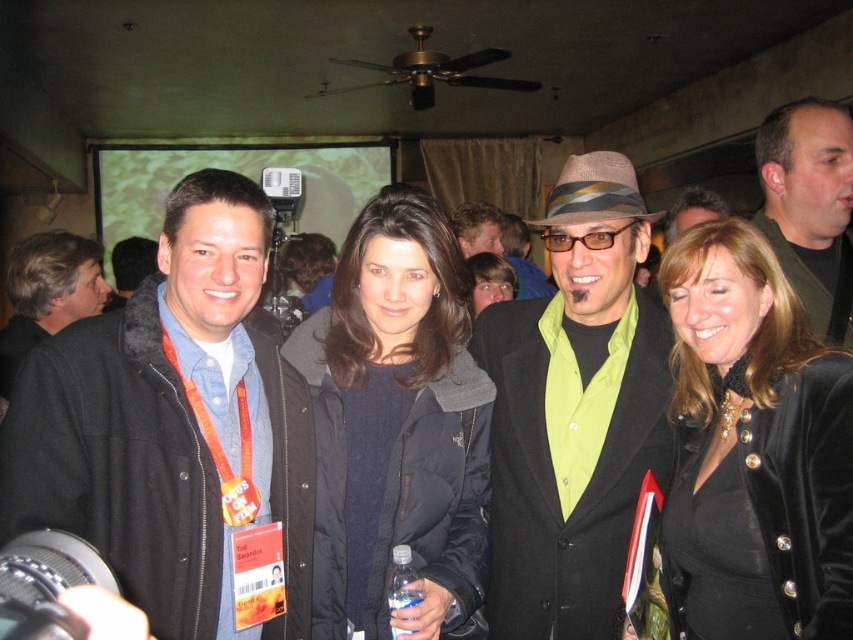
Question: Which point is farther to the camera?

Choices:
 (A) (820, 205)
 (B) (363, 592)

Answer: (A)

Question: Is matte black coat at center positioned behind matte black jacket at center?

Choices:
 (A) yes
 (B) no

Answer: (B)

Question: Which point is farther to the camera?

Choices:
 (A) click(418, 332)
 (B) click(585, 516)

Answer: (B)

Question: Can you confirm if green matte shirt at center is thinner than matte black jacket at center?

Choices:
 (A) no
 (B) yes

Answer: (A)

Question: Can you confirm if denim jacket at left is positioned above light brown hair at center?

Choices:
 (A) yes
 (B) no

Answer: (B)

Question: Which point is closer to the camera?

Choices:
 (A) (381, 481)
 (B) (804, 349)
 (C) (799, 273)

Answer: (B)